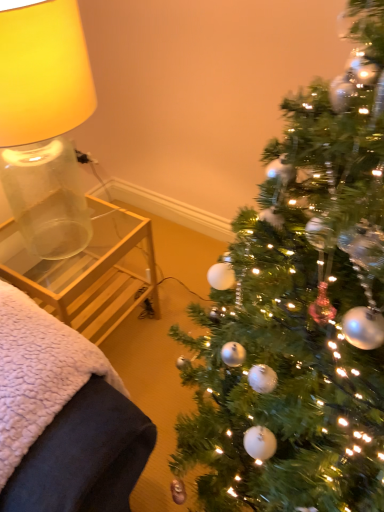
Locate an element on the screen. green textured christmas tree at right is located at coordinates (301, 311).

Image resolution: width=384 pixels, height=512 pixels. What do you see at coordinates (63, 418) in the screenshot?
I see `clear glass side table at left` at bounding box center [63, 418].

This screenshot has width=384, height=512. Find the location of `clear glass table at left`. clear glass table at left is located at coordinates (92, 274).

Is clear glass table at left bigger or smaller than green textured christmas tree at right?

clear glass table at left is smaller than green textured christmas tree at right.

Considering the sizes of clear glass table at left and green textured christmas tree at right in the image, is clear glass table at left taller or shorter than green textured christmas tree at right?

In the image, clear glass table at left appears to be shorter than green textured christmas tree at right.

Which object is thinner, clear glass table at left or green textured christmas tree at right?

Thinner between the two is clear glass table at left.

Does point (128, 228) come behind point (382, 495)?

Yes, it is behind point (382, 495).

In the scene shown: Is translucent glass lampshade at left inside or outside of clear glass table at left?

translucent glass lampshade at left lies outside clear glass table at left.

From a real-world perspective, which object stands above the other?

translucent glass lampshade at left.

Is translucent glass lampshade at left not close to clear glass table at left?

translucent glass lampshade at left is near clear glass table at left, not far away.

From the image's perspective, is translucent glass lampshade at left located above or below clear glass table at left?

From the image's perspective, translucent glass lampshade at left appears above clear glass table at left.

Consider the image. Does green textured christmas tree at right have a lesser height compared to clear glass side table at left?

In fact, green textured christmas tree at right may be taller than clear glass side table at left.

Is green textured christmas tree at right oriented away from clear glass side table at left?

No, green textured christmas tree at right is not facing away from clear glass side table at left.

From a real-world perspective, who is located lower, green textured christmas tree at right or clear glass side table at left?

clear glass side table at left.

Which object is further away from the camera, green textured christmas tree at right or clear glass side table at left?

clear glass side table at left is further away from the camera.

Is clear glass side table at left situated inside translucent glass lampshade at left or outside?

The correct answer is: outside.

Consider the image. Is clear glass side table at left aimed at translucent glass lampshade at left?

No.

Considering the relative sizes of clear glass side table at left and translucent glass lampshade at left in the image provided, is clear glass side table at left shorter than translucent glass lampshade at left?

Yes.

Considering the positions of objects clear glass table at left and clear glass side table at left in the image provided, who is in front, clear glass table at left or clear glass side table at left?

clear glass side table at left.

In the image, is clear glass table at left on the left side or the right side of clear glass side table at left?

clear glass table at left is to the right of clear glass side table at left.

From the image's perspective, which is below, clear glass table at left or clear glass side table at left?

From the image's view, clear glass side table at left is below.

In the scene shown: How many degrees apart are the facing directions of clear glass table at left and clear glass side table at left?

clear glass table at left and clear glass side table at left are facing 0.688 degrees away from each other.

Is clear glass table at left facing towards translucent glass lampshade at left?

No, clear glass table at left is not oriented towards translucent glass lampshade at left.

Considering the sizes of objects clear glass table at left and translucent glass lampshade at left in the image provided, who is taller, clear glass table at left or translucent glass lampshade at left?

translucent glass lampshade at left.

Is point (8, 225) positioned in front of point (7, 89)?

That is False.

Is clear glass table at left not inside translucent glass lampshade at left?

clear glass table at left lies outside translucent glass lampshade at left's area.

From the image's perspective, is translucent glass lampshade at left positioned above or below clear glass side table at left?

From the image's perspective, translucent glass lampshade at left appears above clear glass side table at left.

In the image, there is a translucent glass lampshade at left. Where is `furniture below it (from a real-world perspective)`? furniture below it (from a real-world perspective) is located at coordinates (63, 418).

Who is more distant, translucent glass lampshade at left or clear glass side table at left?

translucent glass lampshade at left is further from the camera.

Based on the photo, is clear glass side table at left at the back of translucent glass lampshade at left?

No, clear glass side table at left is not at the back of translucent glass lampshade at left.

In order to click on table located on the left of green textured christmas tree at right in this screenshot , I will do `click(92, 274)`.

Find the location of a particular element. The width and height of the screenshot is (384, 512). table below the translucent glass lampshade at left (from the image's perspective) is located at coordinates (92, 274).

From the image, which object appears to be nearer to translucent glass lampshade at left, clear glass table at left or clear glass side table at left?

clear glass table at left is positioned closer to the anchor translucent glass lampshade at left.

From the image, which object appears to be farther from translucent glass lampshade at left, green textured christmas tree at right or clear glass table at left?

green textured christmas tree at right lies further to translucent glass lampshade at left than the other object.

Based on their spatial positions, is green textured christmas tree at right or clear glass table at left further from clear glass side table at left?

clear glass table at left.

When comparing their distances from translucent glass lampshade at left, does clear glass table at left or green textured christmas tree at right seem further?

green textured christmas tree at right lies further to translucent glass lampshade at left than the other object.

From the image, which object appears to be farther from clear glass table at left, green textured christmas tree at right or clear glass side table at left?

green textured christmas tree at right is further to clear glass table at left.

Based on their spatial positions, is clear glass side table at left or green textured christmas tree at right further from clear glass table at left?

green textured christmas tree at right is further to clear glass table at left.

From the image, which object appears to be nearer to clear glass side table at left, green textured christmas tree at right or translucent glass lampshade at left?

green textured christmas tree at right lies closer to clear glass side table at left than the other object.

From the image, which object appears to be nearer to clear glass table at left, clear glass side table at left or translucent glass lampshade at left?

translucent glass lampshade at left lies closer to clear glass table at left than the other object.

Image resolution: width=384 pixels, height=512 pixels. In order to click on table lamp positioned between clear glass side table at left and clear glass table at left from near to far in this screenshot , I will do `click(44, 124)`.

Identify the location of furniture between translucent glass lampshade at left and green textured christmas tree at right in the horizontal direction. The width and height of the screenshot is (384, 512). (63, 418).

Identify the location of furniture located between green textured christmas tree at right and clear glass table at left in the depth direction. The image size is (384, 512). (63, 418).

What are the coordinates of `table lamp positioned between green textured christmas tree at right and clear glass table at left from near to far` in the screenshot? It's located at (44, 124).